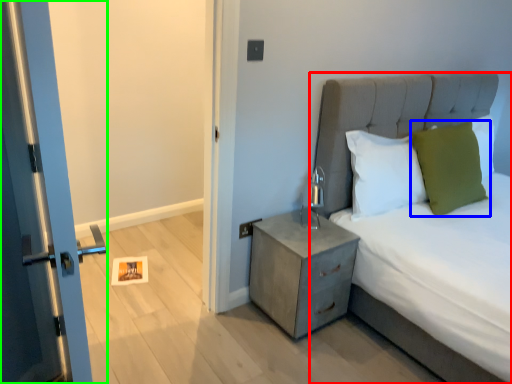
Question: Which is farther away from bed (highlighted by a red box)? pillow (highlighted by a blue box) or door (highlighted by a green box)?

Choices:
 (A) pillow
 (B) door

Answer: (B)